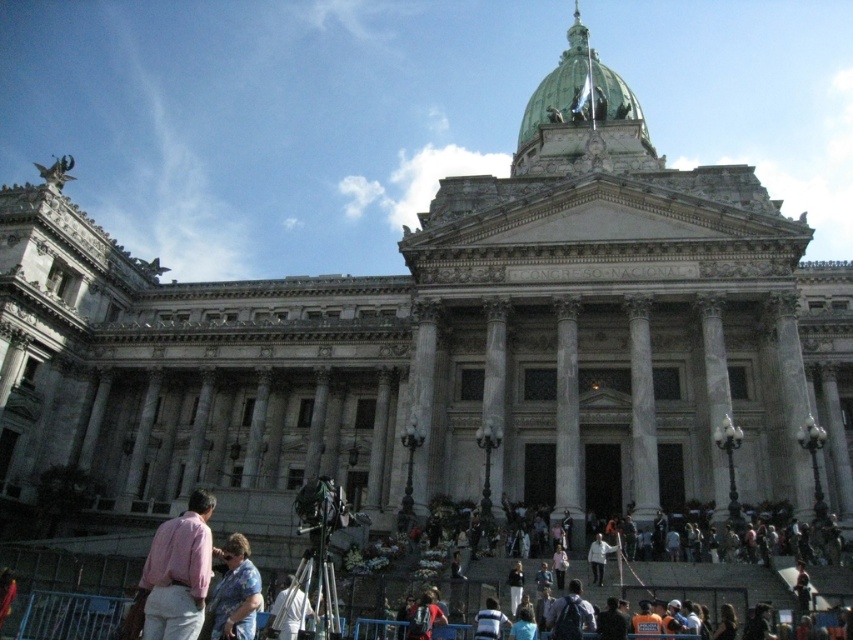
Based on the photo, who is shorter, green polished dome at upper center or pink cotton shirt at lower left?

Standing shorter between the two is pink cotton shirt at lower left.

At what (x,y) coordinates should I click in order to perform the action: click on green polished dome at upper center. Please return your answer as a coordinate pair (x, y). Image resolution: width=853 pixels, height=640 pixels. Looking at the image, I should click on (582, 118).

Is point (540, 106) positioned after point (202, 499)?

Yes.

At what (x,y) coordinates should I click in order to perform the action: click on green polished dome at upper center. Please return your answer as a coordinate pair (x, y). The image size is (853, 640). Looking at the image, I should click on (582, 118).

Who is positioned more to the right, floral shirt at lower center or white fabric shirt at lower center?

white fabric shirt at lower center

Is floral shirt at lower center in front of white fabric shirt at lower center?

That is True.

What do you see at coordinates (234, 593) in the screenshot?
I see `floral shirt at lower center` at bounding box center [234, 593].

At what (x,y) coordinates should I click in order to perform the action: click on floral shirt at lower center. Please return your answer as a coordinate pair (x, y). This screenshot has width=853, height=640. Looking at the image, I should click on (234, 593).

Between floral shirt at lower center and white fabric at lower center, which one has more height?

floral shirt at lower center

Which is in front, point (219, 632) or point (604, 548)?

Point (219, 632) is in front.

Does point (241, 618) come in front of point (601, 568)?

Yes, point (241, 618) is in front of point (601, 568).

This screenshot has height=640, width=853. I want to click on floral shirt at lower center, so click(234, 593).